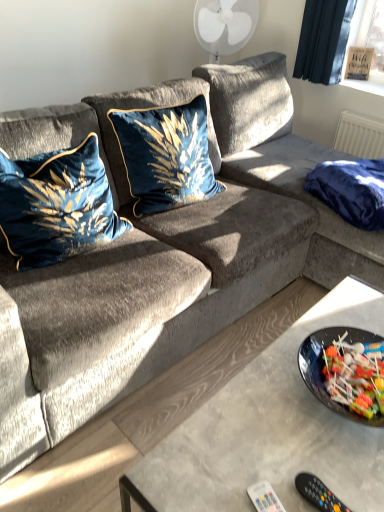
Describe the element at coordinates (318, 493) in the screenshot. The height and width of the screenshot is (512, 384). I see `black plastic remote control at lower right` at that location.

Describe the element at coordinates (351, 190) in the screenshot. I see `navy blue fabric at right` at that location.

Image resolution: width=384 pixels, height=512 pixels. Find the location of `white plastic remote at lower center`. white plastic remote at lower center is located at coordinates (264, 497).

Describe the element at coordinates (264, 497) in the screenshot. The image size is (384, 512). I see `white plastic remote at lower center` at that location.

The height and width of the screenshot is (512, 384). Describe the element at coordinates (165, 155) in the screenshot. I see `velvet blue pillow at center, which ranks as the 1th pillow in right-to-left order` at that location.

Where is `velvet blue pillow at left, arranged as the second pillow when viewed from the right`? This screenshot has height=512, width=384. velvet blue pillow at left, arranged as the second pillow when viewed from the right is located at coordinates (57, 205).

Is velvet blue pillow at left, placed as the first pillow when sorted from left to right, oriented away from black plastic remote control at lower right?

No.

Considering the relative sizes of velvet blue pillow at left, arranged as the second pillow when viewed from the right, and black plastic remote control at lower right in the image provided, is velvet blue pillow at left, arranged as the second pillow when viewed from the right, bigger than black plastic remote control at lower right?

Correct, velvet blue pillow at left, arranged as the second pillow when viewed from the right, is larger in size than black plastic remote control at lower right.

From the picture: From a real-world perspective, is velvet blue pillow at left, placed as the first pillow when sorted from left to right, positioned above or below black plastic remote control at lower right?

velvet blue pillow at left, placed as the first pillow when sorted from left to right, is situated higher than black plastic remote control at lower right in the real world.

Considering the relative positions of velvet blue pillow at left, arranged as the second pillow when viewed from the right, and black plastic remote control at lower right in the image provided, is velvet blue pillow at left, arranged as the second pillow when viewed from the right, to the left of black plastic remote control at lower right from the viewer's perspective?

Indeed, velvet blue pillow at left, arranged as the second pillow when viewed from the right, is positioned on the left side of black plastic remote control at lower right.

At what (x,y) coordinates should I click in order to perform the action: click on remote control on the left of navy blue fabric at right. Please return your answer as a coordinate pair (x, y). The image size is (384, 512). Looking at the image, I should click on (318, 493).

Is black plastic remote control at lower right looking in the opposite direction of navy blue fabric at right?

No, black plastic remote control at lower right's orientation is not away from navy blue fabric at right.

Is there a large distance between black plastic remote control at lower right and navy blue fabric at right?

That's right, there is a large distance between black plastic remote control at lower right and navy blue fabric at right.

Considering the positions of point (322, 486) and point (311, 175), is point (322, 486) closer or farther from the camera than point (311, 175)?

Point (322, 486) appears to be closer to the viewer than point (311, 175).

Considering the relative sizes of white plastic remote at lower center and velvet blue pillow at center, the second pillow positioned from the left, in the image provided, is white plastic remote at lower center thinner than velvet blue pillow at center, the second pillow positioned from the left,?

Indeed, white plastic remote at lower center has a lesser width compared to velvet blue pillow at center, the second pillow positioned from the left.

Is point (252, 501) positioned in front of point (151, 129)?

Yes.

Which object is closer to the camera taking this photo, white plastic remote at lower center or velvet blue pillow at center, the second pillow positioned from the left?

white plastic remote at lower center is closer to the camera.

Which is correct: velvet blue pillow at center, the second pillow positioned from the left, is inside velvet blue pillow at left, arranged as the second pillow when viewed from the right, or outside of it?

velvet blue pillow at center, the second pillow positioned from the left, is not enclosed by velvet blue pillow at left, arranged as the second pillow when viewed from the right.

Does velvet blue pillow at center, the second pillow positioned from the left, lie in front of velvet blue pillow at left, arranged as the second pillow when viewed from the right?

No, velvet blue pillow at center, the second pillow positioned from the left, is behind velvet blue pillow at left, arranged as the second pillow when viewed from the right.

From the image's perspective, is velvet blue pillow at center, which ranks as the 1th pillow in right-to-left order, positioned above or below velvet blue pillow at left, arranged as the second pillow when viewed from the right?

Clearly, from the image's perspective, velvet blue pillow at center, which ranks as the 1th pillow in right-to-left order, is above velvet blue pillow at left, arranged as the second pillow when viewed from the right.

From the picture: Can you confirm if velvet blue pillow at center, the second pillow positioned from the left, is shorter than velvet blue pillow at left, placed as the first pillow when sorted from left to right?

In fact, velvet blue pillow at center, the second pillow positioned from the left, may be taller than velvet blue pillow at left, placed as the first pillow when sorted from left to right.

Which of these two, velvet blue pillow at left, arranged as the second pillow when viewed from the right, or white plastic remote at lower center, is wider?

velvet blue pillow at left, arranged as the second pillow when viewed from the right, is wider.

From the image's perspective, is velvet blue pillow at left, arranged as the second pillow when viewed from the right, under white plastic remote at lower center?

Actually, velvet blue pillow at left, arranged as the second pillow when viewed from the right, appears above white plastic remote at lower center in the image.

You are a GUI agent. You are given a task and a screenshot of the screen. Output one action in this format:
    pyautogui.click(x=<x>, y=<y>)
    Task: Click on the remote in front of the velvet blue pillow at left, arranged as the second pillow when viewed from the right
    This screenshot has height=512, width=384.
    Given the screenshot: What is the action you would take?
    pyautogui.click(x=264, y=497)

Is white plastic remote at lower center looking in the opposite direction of navy blue fabric at right?

No.

From the image's perspective, which object appears higher, white plastic remote at lower center or navy blue fabric at right?

navy blue fabric at right.

Who is bigger, white plastic remote at lower center or navy blue fabric at right?

navy blue fabric at right.

Between velvet blue pillow at center, the second pillow positioned from the left, and black plastic remote control at lower right, which one appears on the right side from the viewer's perspective?

black plastic remote control at lower right is more to the right.

Between velvet blue pillow at center, which ranks as the 1th pillow in right-to-left order, and black plastic remote control at lower right, which one has larger width?

With larger width is velvet blue pillow at center, which ranks as the 1th pillow in right-to-left order.

Between velvet blue pillow at center, which ranks as the 1th pillow in right-to-left order, and black plastic remote control at lower right, which one has less height?

black plastic remote control at lower right is shorter.

Does velvet blue pillow at center, the second pillow positioned from the left, touch black plastic remote control at lower right?

No, velvet blue pillow at center, the second pillow positioned from the left, is not next to black plastic remote control at lower right.

From the image's perspective, which pillow is the 1st one above the black plastic remote control at lower right? Please provide its 2D coordinates.

[(57, 205)]

Where is `remote control that appears on the left of navy blue fabric at right`? remote control that appears on the left of navy blue fabric at right is located at coordinates (318, 493).

Looking at the image, which one is located further to velvet blue pillow at center, which ranks as the 1th pillow in right-to-left order, white plastic remote at lower center or black plastic remote control at lower right?

white plastic remote at lower center is positioned further to the anchor velvet blue pillow at center, which ranks as the 1th pillow in right-to-left order.

Considering their positions, is velvet blue pillow at center, which ranks as the 1th pillow in right-to-left order, positioned closer to velvet blue pillow at left, arranged as the second pillow when viewed from the right, than navy blue fabric at right?

velvet blue pillow at center, which ranks as the 1th pillow in right-to-left order, lies closer to velvet blue pillow at left, arranged as the second pillow when viewed from the right, than the other object.

When comparing their distances from white plastic remote at lower center, does black plastic remote control at lower right or velvet blue pillow at center, which ranks as the 1th pillow in right-to-left order, seem further?

The object further to white plastic remote at lower center is velvet blue pillow at center, which ranks as the 1th pillow in right-to-left order.

From the image, which object appears to be farther from velvet blue pillow at left, placed as the first pillow when sorted from left to right, white plastic remote at lower center or black plastic remote control at lower right?

Based on the image, black plastic remote control at lower right appears to be further to velvet blue pillow at left, placed as the first pillow when sorted from left to right.

From the image, which object appears to be nearer to velvet blue pillow at left, arranged as the second pillow when viewed from the right, white plastic remote at lower center or velvet blue pillow at center, which ranks as the 1th pillow in right-to-left order?

Based on the image, velvet blue pillow at center, which ranks as the 1th pillow in right-to-left order, appears to be nearer to velvet blue pillow at left, arranged as the second pillow when viewed from the right.

Looking at the image, which one is located further to navy blue fabric at right, black plastic remote control at lower right or velvet blue pillow at center, which ranks as the 1th pillow in right-to-left order?

black plastic remote control at lower right lies further to navy blue fabric at right than the other object.

When comparing their distances from velvet blue pillow at left, arranged as the second pillow when viewed from the right, does velvet blue pillow at center, which ranks as the 1th pillow in right-to-left order, or black plastic remote control at lower right seem closer?

velvet blue pillow at center, which ranks as the 1th pillow in right-to-left order, is closer to velvet blue pillow at left, arranged as the second pillow when viewed from the right.

Based on their spatial positions, is velvet blue pillow at left, arranged as the second pillow when viewed from the right, or navy blue fabric at right further from velvet blue pillow at center, which ranks as the 1th pillow in right-to-left order?

navy blue fabric at right.

At what (x,y) coordinates should I click in order to perform the action: click on pillow between velvet blue pillow at center, which ranks as the 1th pillow in right-to-left order, and black plastic remote control at lower right from top to bottom. Please return your answer as a coordinate pair (x, y). Looking at the image, I should click on (57, 205).

I want to click on pillow between velvet blue pillow at left, arranged as the second pillow when viewed from the right, and navy blue fabric at right, in the horizontal direction, so click(165, 155).

Identify the location of pillow between velvet blue pillow at center, the second pillow positioned from the left, and white plastic remote at lower center in the up-down direction. The image size is (384, 512). (57, 205).

This screenshot has width=384, height=512. Find the location of `remote control between velvet blue pillow at center, which ranks as the 1th pillow in right-to-left order, and white plastic remote at lower center vertically`. remote control between velvet blue pillow at center, which ranks as the 1th pillow in right-to-left order, and white plastic remote at lower center vertically is located at coordinates (318, 493).